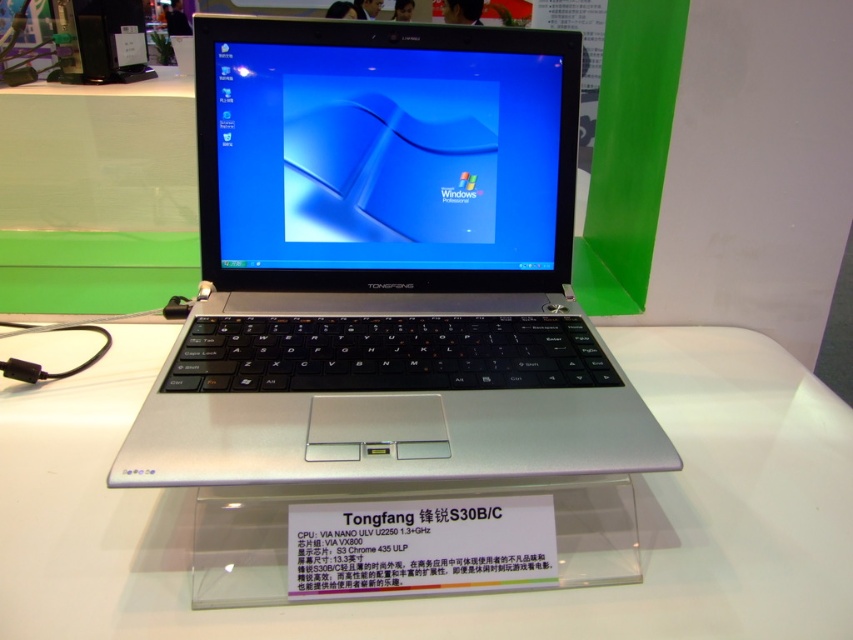
Question: Estimate the real-world distances between objects in this image. Which object is farther from the silver metallic table at center?

Choices:
 (A) silver metallic laptop at center
 (B) transparent glass display at center

Answer: (A)

Question: Does silver metallic laptop at center have a greater width compared to silver metallic table at center?

Choices:
 (A) yes
 (B) no

Answer: (B)

Question: Is the position of silver metallic laptop at center less distant than that of transparent glass display at center?

Choices:
 (A) yes
 (B) no

Answer: (A)

Question: Based on their relative distances, which object is farther from the silver metallic laptop at center?

Choices:
 (A) silver metallic table at center
 (B) transparent glass display at center

Answer: (A)

Question: Which object appears farthest from the camera in this image?

Choices:
 (A) silver metallic table at center
 (B) silver metallic laptop at center

Answer: (A)

Question: Does silver metallic table at center have a lesser width compared to transparent glass display at center?

Choices:
 (A) yes
 (B) no

Answer: (B)